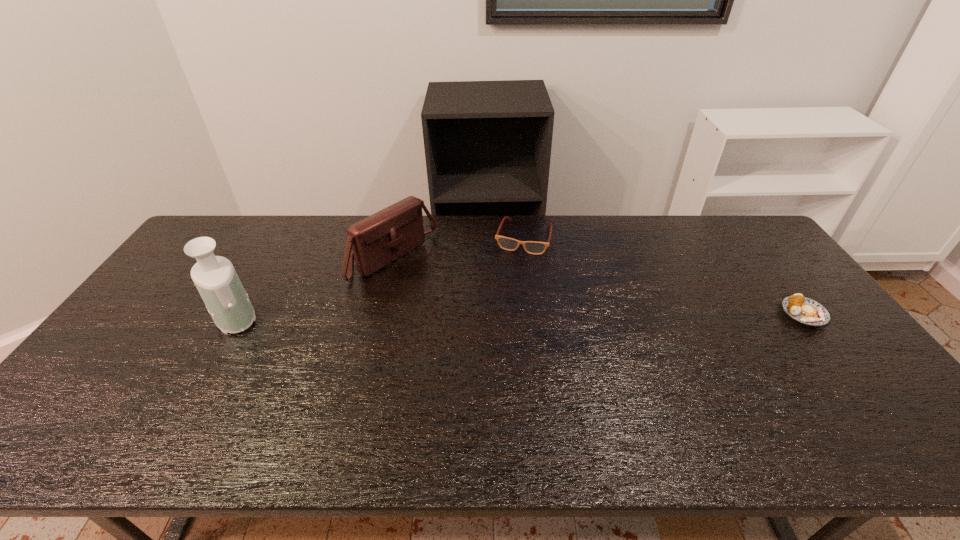
Find the location of `vacant space positioned on the front flap of the shoulder bag`. vacant space positioned on the front flap of the shoulder bag is located at coordinates (456, 299).

I want to click on blank space located 0.300m on the front flap of the shoulder bag, so click(x=494, y=323).

This screenshot has width=960, height=540. I want to click on vacant space located 0.310m on the front flap of the shoulder bag, so click(497, 325).

Identify the location of free region located on the front-facing side of the spectacles. (494, 329).

This screenshot has width=960, height=540. What are the coordinates of `vacant space situated on the front-facing side of the spectacles` in the screenshot? It's located at (509, 283).

Where is `blank area located on the front-facing side of the spectacles`? blank area located on the front-facing side of the spectacles is located at coordinates (499, 316).

Where is `shoulder bag present at the far edge`? Image resolution: width=960 pixels, height=540 pixels. shoulder bag present at the far edge is located at coordinates (377, 240).

The height and width of the screenshot is (540, 960). Identify the location of spectacles located in the far edge section of the desktop. (532, 247).

Find the location of a particular element. This screenshot has height=540, width=960. object that is at the right edge is located at coordinates (805, 310).

Locate an element on the screen. The width and height of the screenshot is (960, 540). free space at the far edge of the desktop is located at coordinates (694, 222).